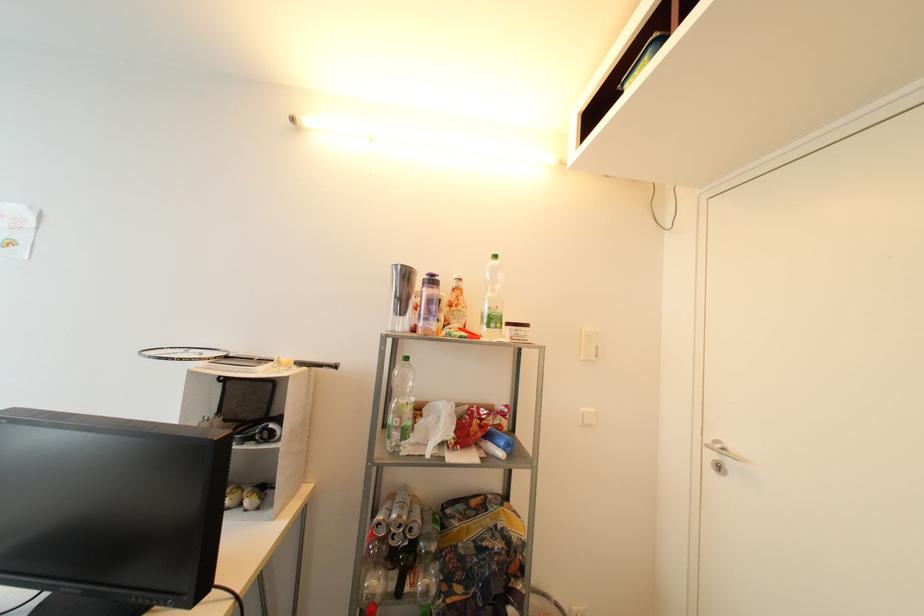
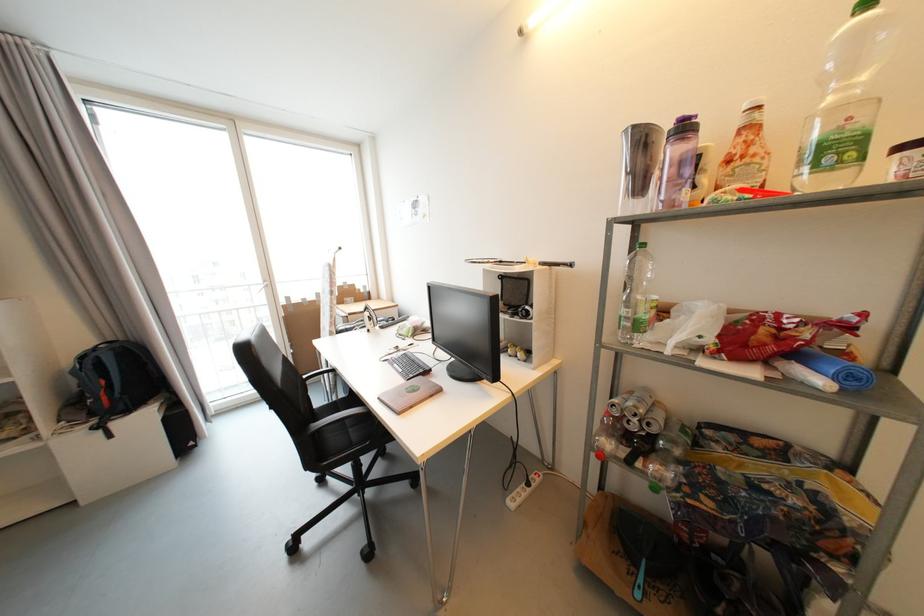
Find the pixel in the second image that matches (398,517) in the first image.

(635, 406)